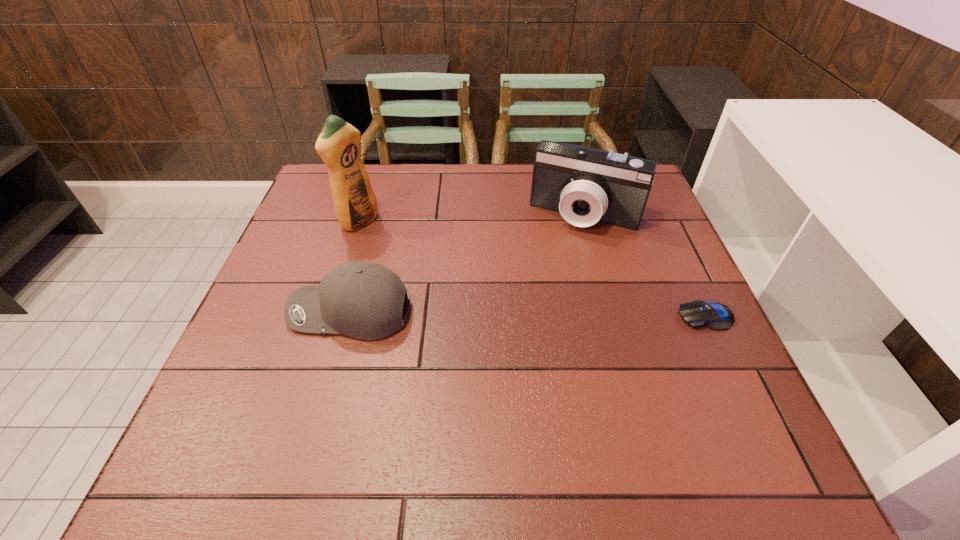
The width and height of the screenshot is (960, 540). What are the coordinates of `the second shortest object` in the screenshot? It's located at (362, 300).

Locate an element on the screen. The width and height of the screenshot is (960, 540). computer mouse is located at coordinates (699, 313).

Locate an element on the screen. The height and width of the screenshot is (540, 960). the second tallest object is located at coordinates coord(585,185).

Where is `the tallest object`? This screenshot has width=960, height=540. the tallest object is located at coordinates pyautogui.click(x=339, y=144).

This screenshot has width=960, height=540. Find the location of `vacant space located 0.080m on the front brim of the baseball cap`. vacant space located 0.080m on the front brim of the baseball cap is located at coordinates (253, 312).

Find the location of a particular element. vacant region located on the front brim of the baseball cap is located at coordinates (267, 312).

The width and height of the screenshot is (960, 540). I want to click on free space located 0.380m on the button side of the computer mouse, so click(x=502, y=316).

The width and height of the screenshot is (960, 540). Find the location of `free space located on the button side of the computer mouse`. free space located on the button side of the computer mouse is located at coordinates (563, 316).

The height and width of the screenshot is (540, 960). I want to click on free location located on the button side of the computer mouse, so click(558, 316).

At what (x,y) coordinates should I click in order to perform the action: click on free space located on the lens of the camcorder. Please return your answer as a coordinate pair (x, y). Image resolution: width=960 pixels, height=540 pixels. Looking at the image, I should click on (556, 267).